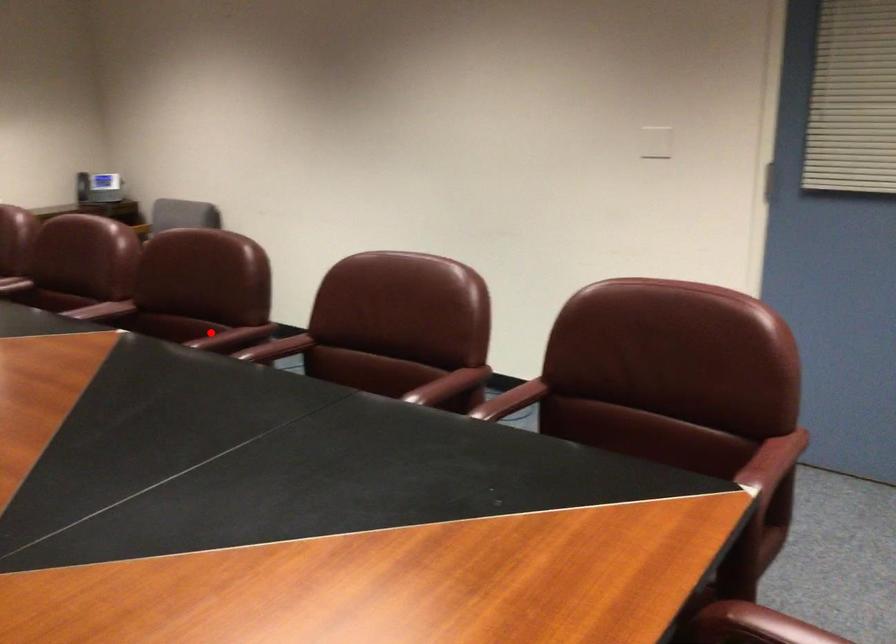
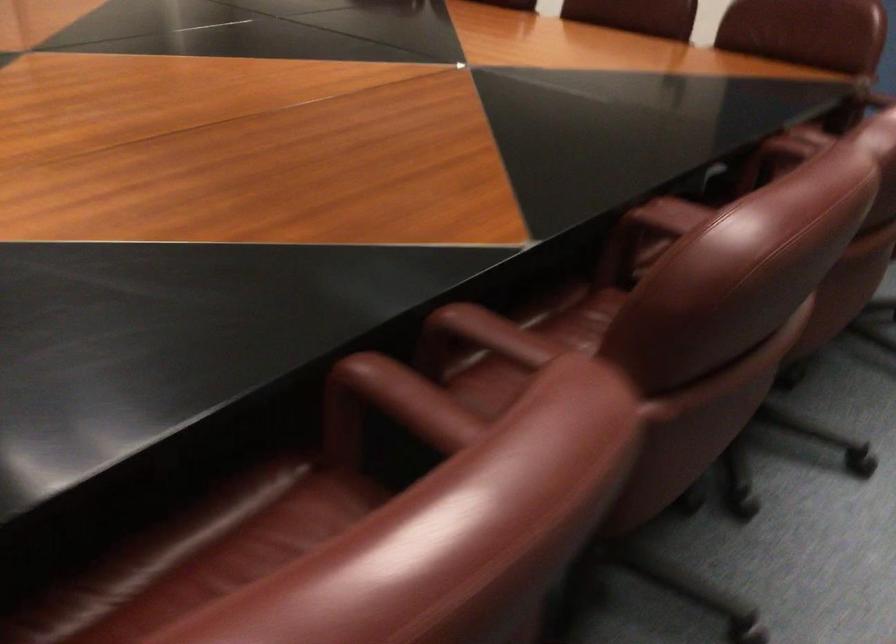
Question: I am providing you with two images of the same scene from different viewpoints. Given a red point in image1, look at the same physical point in image2. Is it:

Choices:
 (A) Closer to the viewpoint
 (B) Farther from the viewpoint

Answer: (A)